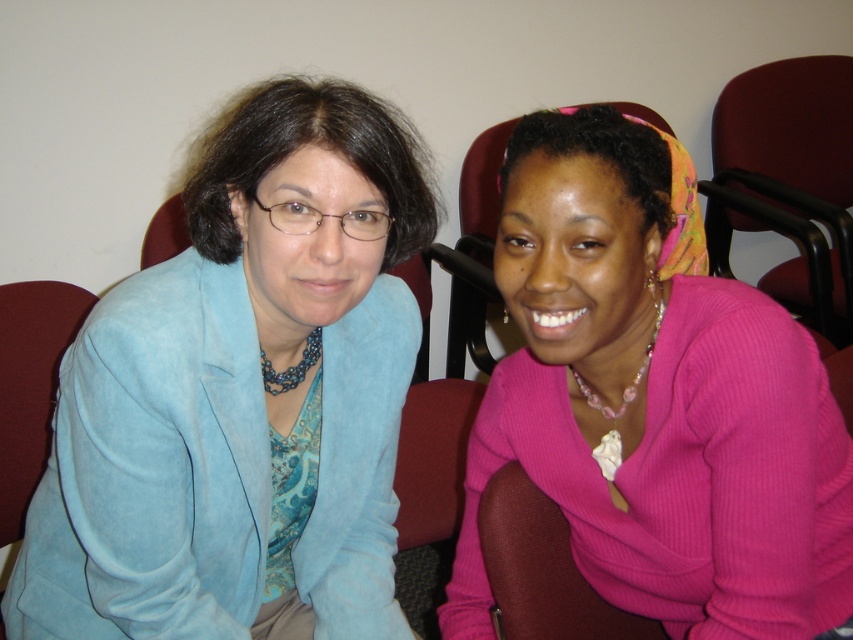
Question: Does pink ribbed sweater at center appear over maroon leather chair at right?

Choices:
 (A) yes
 (B) no

Answer: (B)

Question: Which object is closer to the camera taking this photo?

Choices:
 (A) maroon leather chair at right
 (B) pink ribbed sweater at center

Answer: (B)

Question: Can you confirm if suede blue blazer at left is positioned below maroon leather chair at right?

Choices:
 (A) no
 (B) yes

Answer: (B)

Question: Which of the following is the closest to the observer?

Choices:
 (A) (160, 449)
 (B) (456, 588)

Answer: (A)

Question: Is pink ribbed sweater at center in front of maroon leather chair at right?

Choices:
 (A) yes
 (B) no

Answer: (A)

Question: Which object appears farthest from the camera in this image?

Choices:
 (A) suede blue blazer at left
 (B) maroon leather chair at right

Answer: (B)